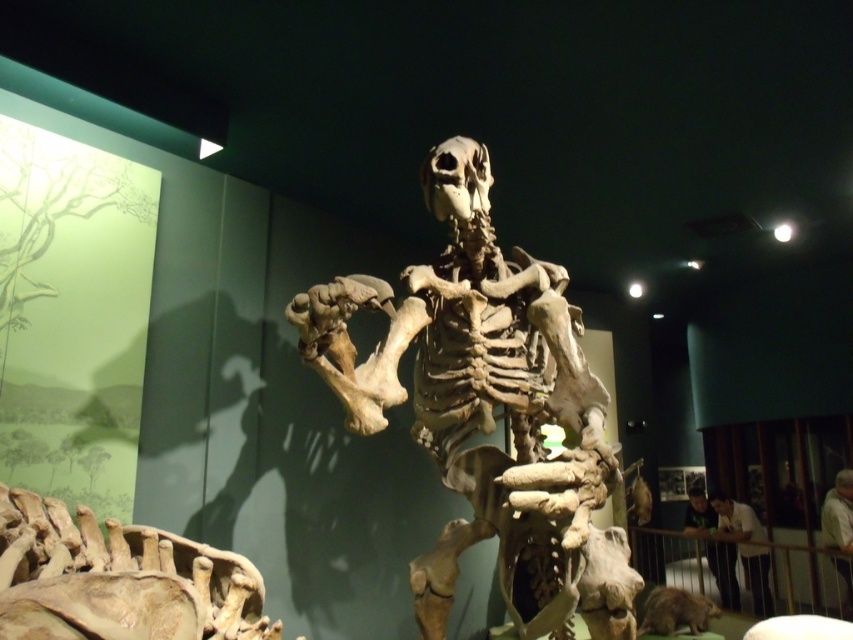
You are standing in the museum exhibit and want to take a photo of the light brown shirt at lower right without including the dinosaur skeleton. Is the distance sufficient to avoid capturing the skeleton in the frame?

The light brown shirt at lower right is 5.61 meters from the viewer. Since the shirt is positioned at a distance away from the dinosaur skeleton, you can likely take a photo of the shirt without including the skeleton in the frame, provided you adjust your camera angle or position accordingly.

You are a visitor standing in front of the museum exhibit. You notice two points marked on the dinosaur skeleton. The first point is at coordinate point (757,538) and the second is at point (653,598). Which of these points is closer to you?

Point (757,538) is further to the viewer than point (653,598), so the point closer to you is point (653,598).

You are a visitor at the museum and see the light brown shirt at lower right and the brown furry animal at lower right. Which one is more to the right?

The light brown shirt at lower right is more to the right because it is positioned on the right side of the brown furry animal at lower right.